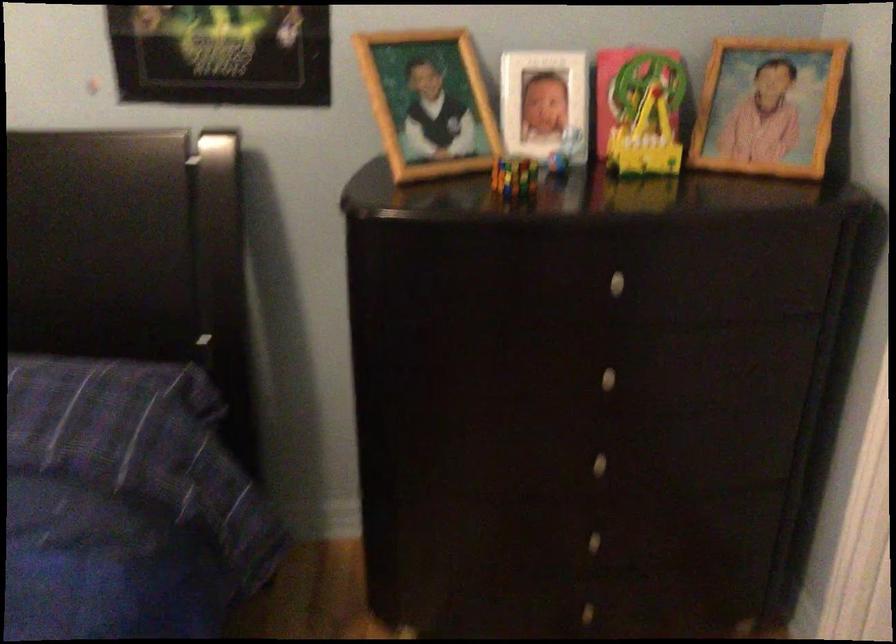
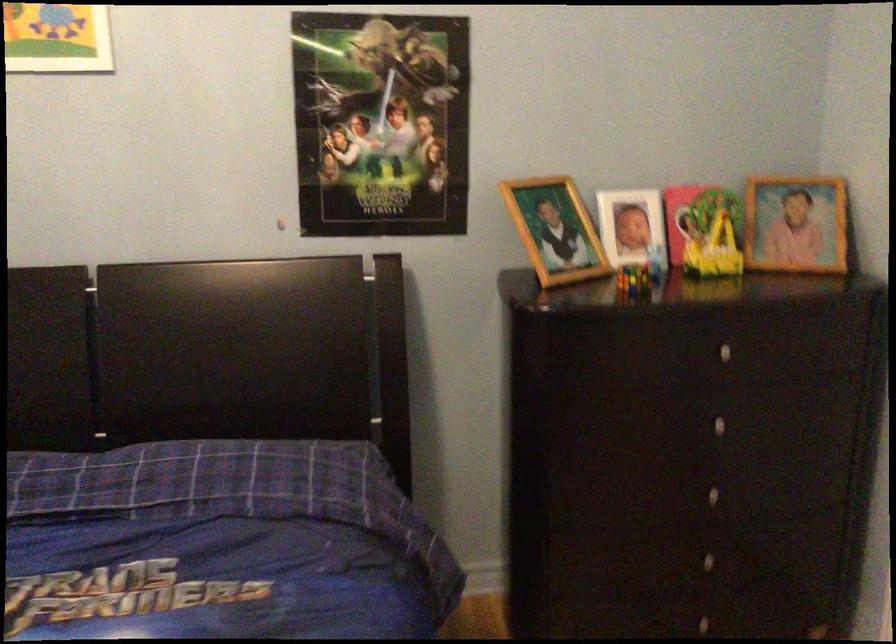
The point at (650, 129) is marked in the first image. Where is the corresponding point in the second image?

(719, 240)